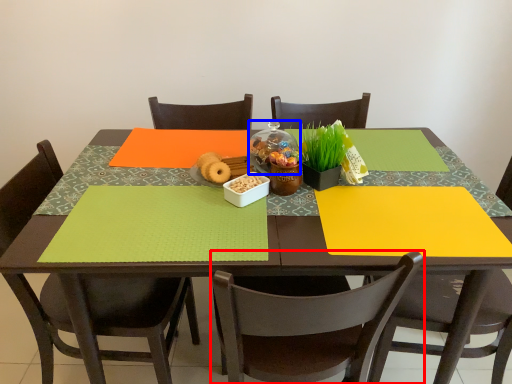
Question: Which object is closer to the camera taking this photo, chair (highlighted by a red box) or glass jar (highlighted by a blue box)?

Choices:
 (A) chair
 (B) glass jar

Answer: (A)